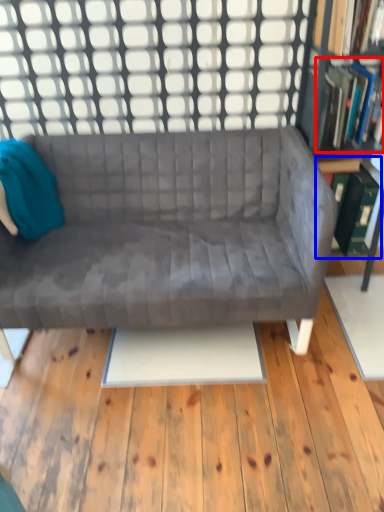
Question: Which object is further to the camera taking this photo, book (highlighted by a red box) or shelf (highlighted by a blue box)?

Choices:
 (A) book
 (B) shelf

Answer: (B)